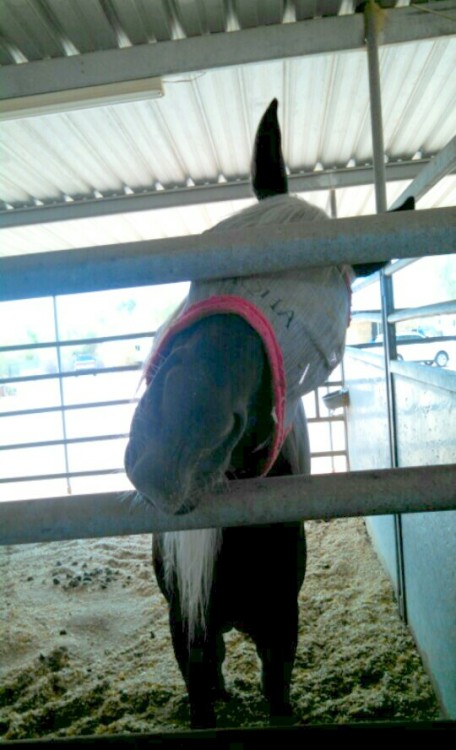
The width and height of the screenshot is (456, 750). In order to click on inside of stable in this screenshot , I will do `click(65, 602)`.